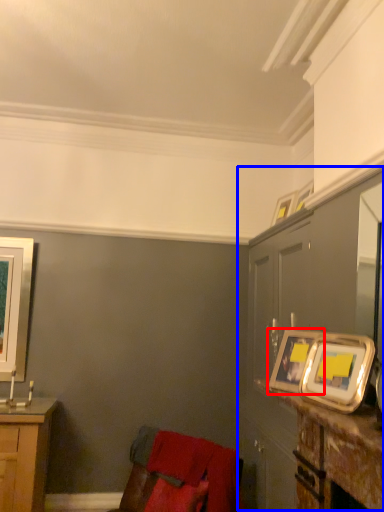
Question: Which object appears farthest to the camera in this image, picture frame (highlighted by a red box) or dresser (highlighted by a blue box)?

Choices:
 (A) picture frame
 (B) dresser

Answer: (B)